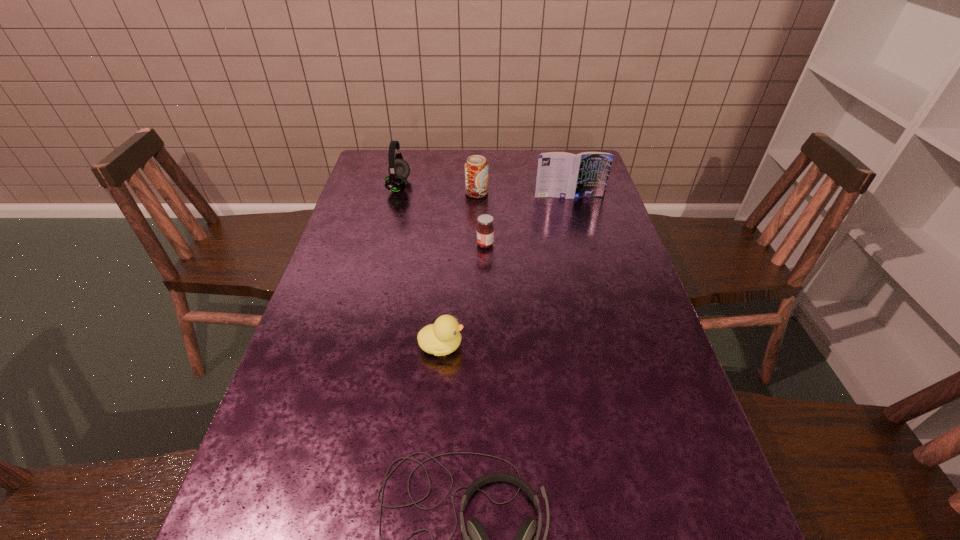
This screenshot has height=540, width=960. In order to click on blank space located 0.170m on the label side of the jam in this screenshot , I will do pyautogui.click(x=419, y=245).

Identify the location of vacant space located 0.250m on the label side of the jam. This screenshot has height=540, width=960. (391, 245).

At what (x,y) coordinates should I click in order to perform the action: click on vacant area located 0.140m at the beak of the duckling. Please return your answer as a coordinate pair (x, y). The image size is (960, 540). Looking at the image, I should click on (525, 346).

The image size is (960, 540). In order to click on object that is at the far edge in this screenshot , I will do `click(399, 170)`.

Identify the location of object that is at the left edge. (399, 170).

Locate an element on the screen. This screenshot has height=540, width=960. object at the right edge is located at coordinates (565, 175).

Find the location of a particular element. object at the far left corner is located at coordinates (399, 170).

In the image, there is a desktop. What are the coordinates of `vacant space at the far edge` in the screenshot? It's located at (462, 156).

Image resolution: width=960 pixels, height=540 pixels. I want to click on free region at the left edge, so click(351, 355).

Identify the location of vacant space at the right edge. The height and width of the screenshot is (540, 960). (598, 213).